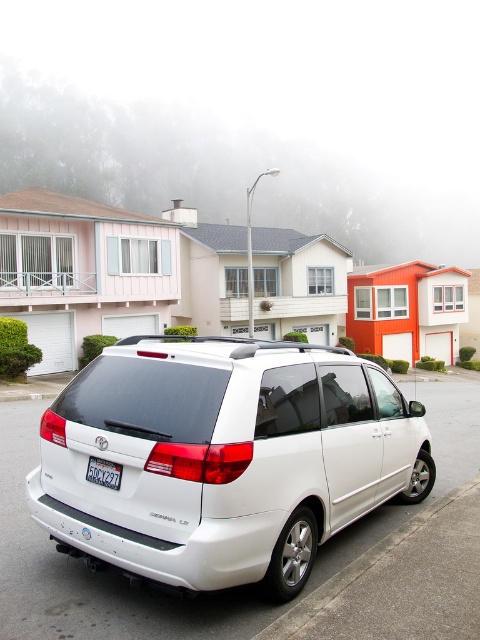
You are a delivery driver who needs to park your van as close as possible to the curb without crossing over it. The van is 7.5 feet wide. Can you safely park the van between the gray asphalt curb at lower right and the camera?

The distance between the gray asphalt curb at lower right and the camera is 9.40 feet. Since the van is 7.5 feet wide, there is enough space to park safely without crossing the curb.